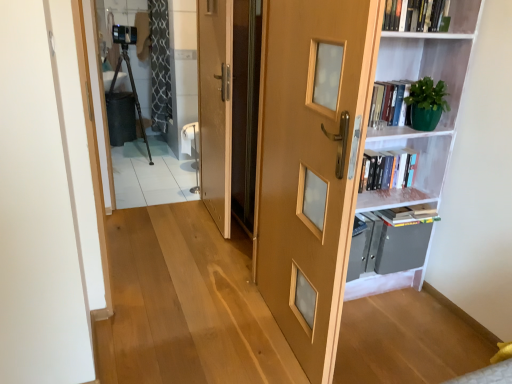
Question: Can we say hardcover book at upper right, positioned as the second book in top-to-bottom order, lies outside black textured curtain at upper left?

Choices:
 (A) yes
 (B) no

Answer: (A)

Question: Is the surface of hardcover book at upper right, placed as the second book when sorted from front to back, in direct contact with black textured curtain at upper left?

Choices:
 (A) yes
 (B) no

Answer: (B)

Question: Is hardcover book at upper right, arranged as the 1th book when viewed from the back, closer to camera compared to black textured curtain at upper left?

Choices:
 (A) no
 (B) yes

Answer: (B)

Question: From a real-world perspective, is hardcover book at upper right, the first book positioned from the bottom, over black textured curtain at upper left?

Choices:
 (A) no
 (B) yes

Answer: (A)

Question: Could you tell me if hardcover book at upper right, placed as the second book when sorted from front to back, is turned towards black textured curtain at upper left?

Choices:
 (A) yes
 (B) no

Answer: (B)

Question: Considering their positions, is black textured curtain at upper left located in front of or behind white matte bookshelf at right?

Choices:
 (A) front
 (B) behind

Answer: (B)

Question: Looking at the image, does black textured curtain at upper left seem bigger or smaller compared to white matte bookshelf at right?

Choices:
 (A) big
 (B) small

Answer: (B)

Question: From the image's perspective, is black textured curtain at upper left located above or below white matte bookshelf at right?

Choices:
 (A) below
 (B) above

Answer: (B)

Question: Is black textured curtain at upper left inside the boundaries of white matte bookshelf at right, or outside?

Choices:
 (A) outside
 (B) inside

Answer: (A)

Question: Is clear glass door at upper left in front of or behind wooden door at center, positioned as the 2th door in front-to-back order, in the image?

Choices:
 (A) behind
 (B) front

Answer: (A)

Question: Is clear glass door at upper left inside the boundaries of wooden door at center, which is the second door from right to left, or outside?

Choices:
 (A) inside
 (B) outside

Answer: (B)

Question: Is clear glass door at upper left to the left or to the right of wooden door at center, the first door viewed from the left, in the image?

Choices:
 (A) left
 (B) right

Answer: (A)

Question: Does point (105, 9) appear closer or farther from the camera than point (202, 4)?

Choices:
 (A) farther
 (B) closer

Answer: (A)

Question: Considering the positions of hardcover book at upper right, the first book positioned from the bottom, and wooden door at center, which is the second door from right to left, in the image, is hardcover book at upper right, the first book positioned from the bottom, taller or shorter than wooden door at center, which is the second door from right to left,?

Choices:
 (A) short
 (B) tall

Answer: (A)

Question: Considering the positions of point (381, 170) and point (210, 51), is point (381, 170) closer or farther from the camera than point (210, 51)?

Choices:
 (A) closer
 (B) farther

Answer: (A)